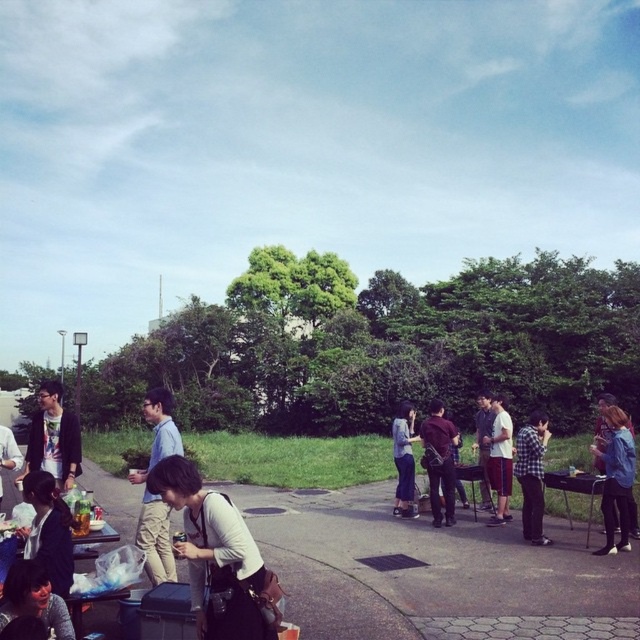
Is point (180, 474) more distant than point (394, 458)?

That is False.

Which is above, matte black jacket at center or denim pants at center?

Positioned higher is matte black jacket at center.

What do you see at coordinates (218, 557) in the screenshot? I see `matte black jacket at center` at bounding box center [218, 557].

You are a GUI agent. You are given a task and a screenshot of the screen. Output one action in this format:
    pyautogui.click(x=<x>, y=<y>)
    Task: Click on the matte black jacket at center
    
    Given the screenshot: What is the action you would take?
    pyautogui.click(x=218, y=557)

Between matte black jacket at lower left and dark brown leather jacket at center, which one appears on the right side from the viewer's perspective?

From the viewer's perspective, dark brown leather jacket at center appears more on the right side.

Between point (26, 604) and point (436, 486), which one is positioned in front?

Point (26, 604)

Find the location of a particular element. The image size is (640, 640). matte black jacket at lower left is located at coordinates (33, 600).

Which is below, white cotton shirt at center or denim pants at center?

denim pants at center is lower down.

Is white cotton shirt at center positioned at the back of denim pants at center?

No, it is in front of denim pants at center.

Between point (500, 476) and point (397, 497), which one is positioned behind?

Point (397, 497)

The image size is (640, 640). In order to click on white cotton shirt at center in this screenshot , I will do `click(499, 460)`.